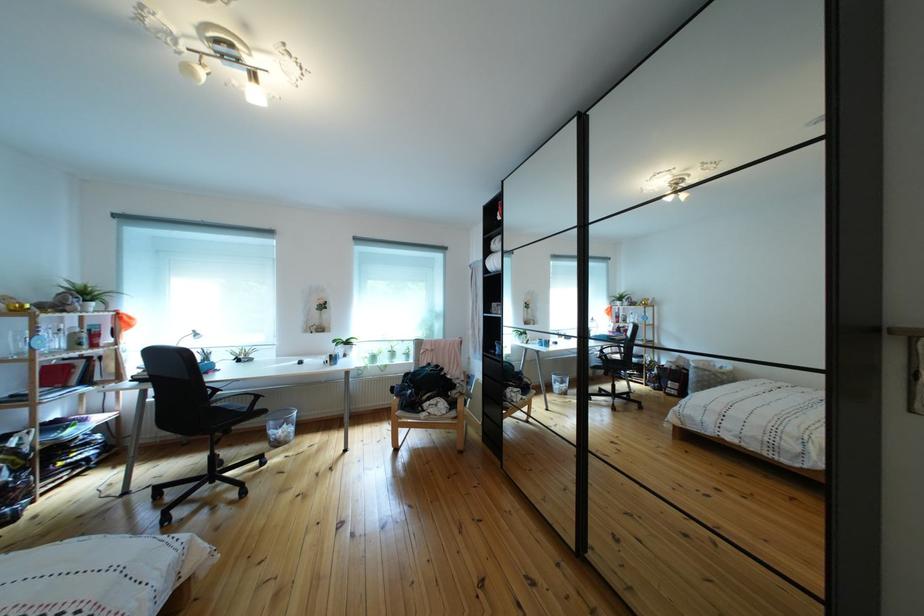
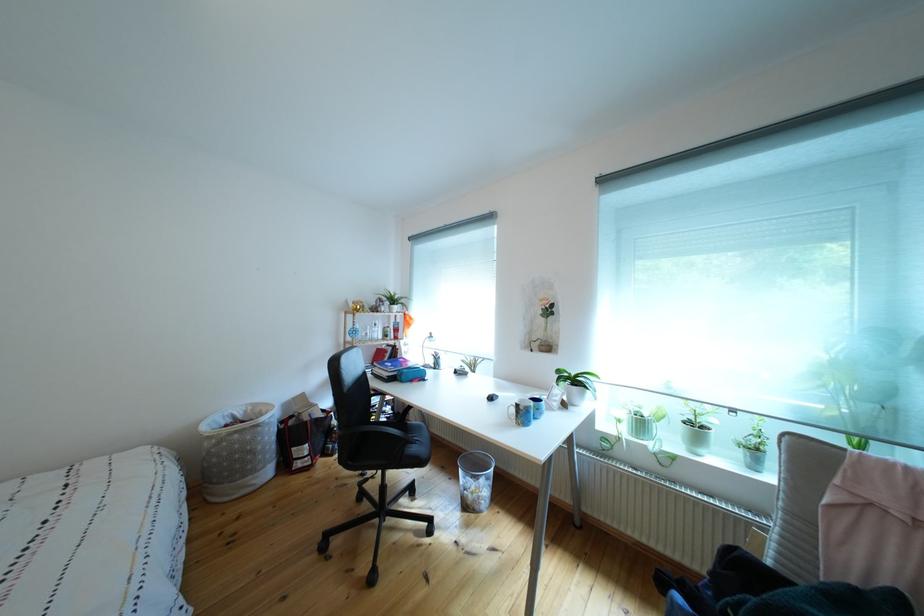
Locate, in the second image, the point that corresponds to the point at 385,363 in the first image.

(652, 430)